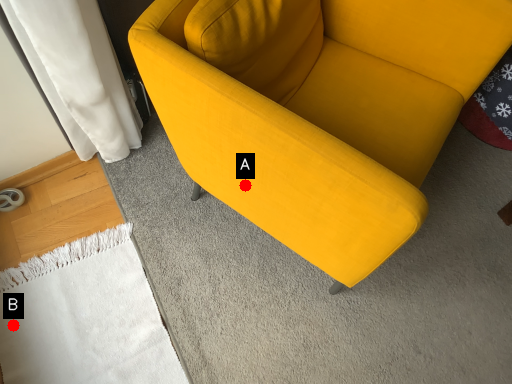
Question: Two points are circled on the image, labeled by A and B beside each circle. Which point appears closest to the camera in this image?

Choices:
 (A) A is closer
 (B) B is closer

Answer: (A)